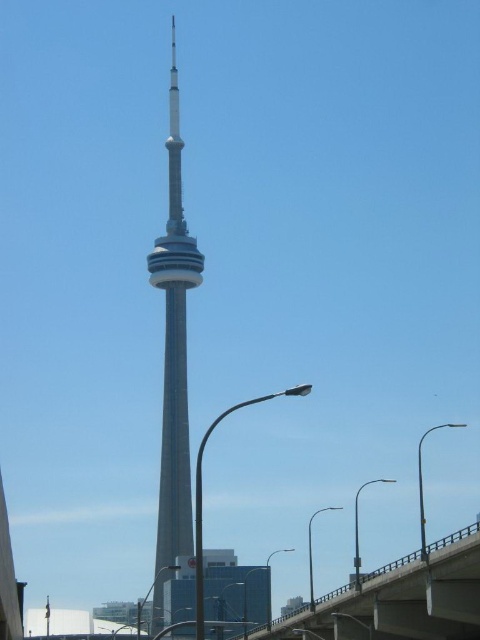
Question: Is metallic gray bridge at lower center wider than smooth gray tower at center?

Choices:
 (A) yes
 (B) no

Answer: (A)

Question: Is metallic gray bridge at lower center further to camera compared to smooth gray tower at center?

Choices:
 (A) yes
 (B) no

Answer: (B)

Question: Can you confirm if metallic gray bridge at lower center is positioned to the right of smooth gray tower at center?

Choices:
 (A) yes
 (B) no

Answer: (A)

Question: Which object is farther from the camera taking this photo?

Choices:
 (A) smooth gray tower at center
 (B) metallic gray bridge at lower center

Answer: (A)